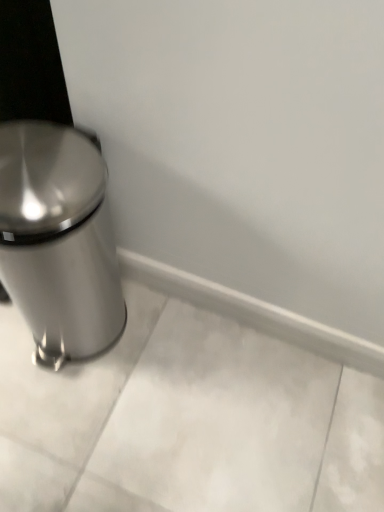
You are a GUI agent. You are given a task and a screenshot of the screen. Output one action in this format:
    pyautogui.click(x=<x>, y=<y>)
    Task: Click on the satin silver trash can at left
    The height and width of the screenshot is (512, 384).
    Given the screenshot: What is the action you would take?
    pyautogui.click(x=58, y=239)

Image resolution: width=384 pixels, height=512 pixels. Describe the element at coordinates (58, 239) in the screenshot. I see `satin silver trash can at left` at that location.

Identify the location of satin silver trash can at left. The image size is (384, 512). (58, 239).